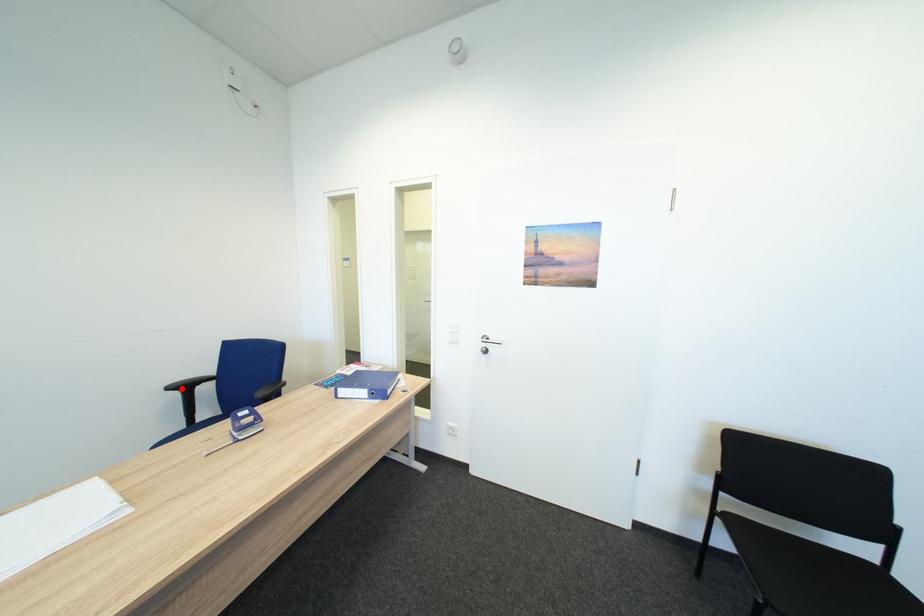
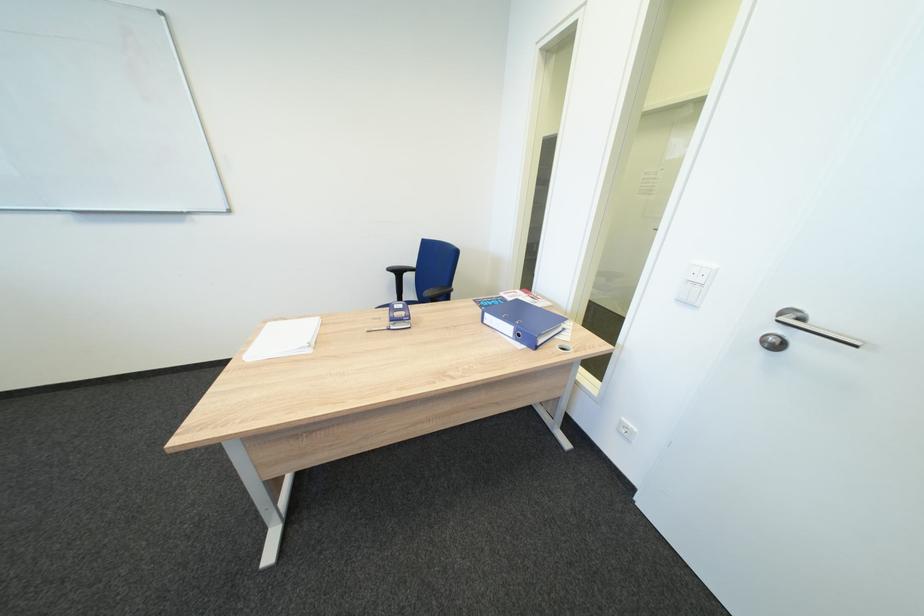
The point at the highlighted location is marked in the first image. Where is the corresponding point in the second image?

(400, 270)